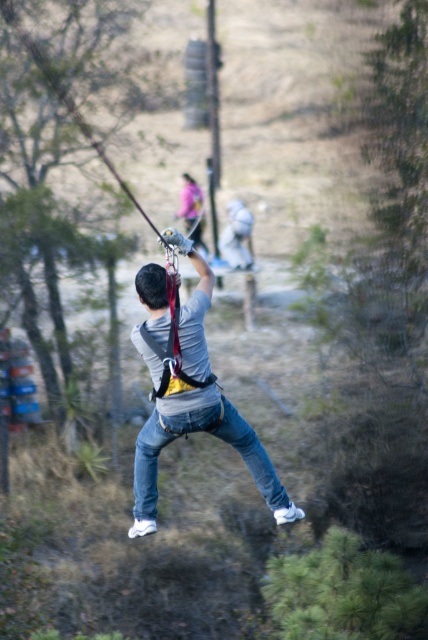
Question: Where is denim jeans at center located in relation to green leafy tree at lower right in the image?

Choices:
 (A) above
 (B) below

Answer: (A)

Question: Can you confirm if green leafy tree at center is wider than matte gray helmet at upper center?

Choices:
 (A) no
 (B) yes

Answer: (A)

Question: Which is farther from the denim jeans at center?

Choices:
 (A) matte gray helmet at upper center
 (B) green leafy tree at center
 (C) green leafy tree at lower right

Answer: (A)

Question: Does green leafy tree at lower right appear under green leafy tree at center?

Choices:
 (A) no
 (B) yes

Answer: (B)

Question: Which of the following is the farthest from the observer?

Choices:
 (A) green leafy tree at center
 (B) matte gray helmet at upper center
 (C) denim jeans at center
 (D) green leafy tree at lower right

Answer: (B)

Question: Considering the real-world distances, which object is closest to the denim jeans at center?

Choices:
 (A) matte gray helmet at upper center
 (B) green leafy tree at center
 (C) green leafy tree at lower right

Answer: (C)